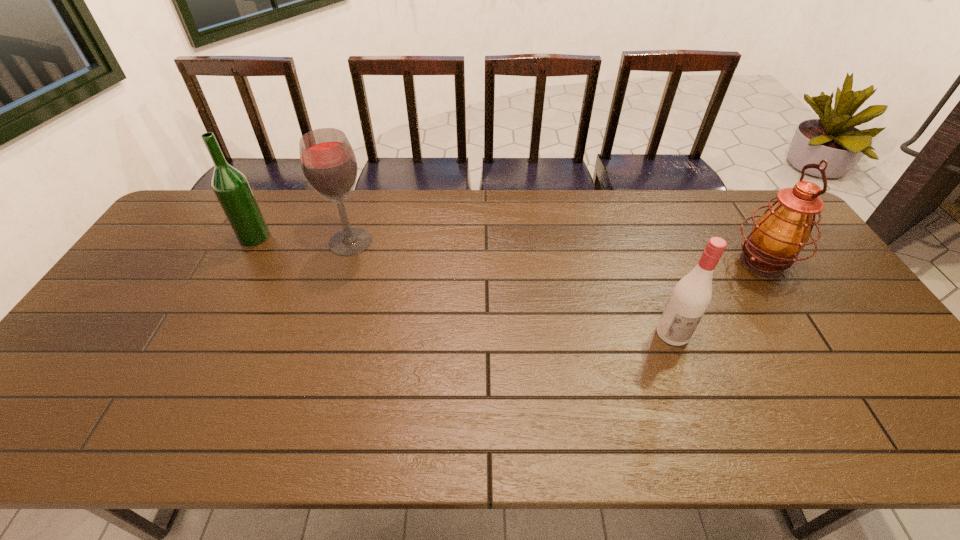
You are a GUI agent. You are given a task and a screenshot of the screen. Output one action in this format:
    pyautogui.click(x=<x>, y=<y>)
    Task: Click on the free space between the rightmost alcohol and the leftmost alcohol
    
    Given the screenshot: What is the action you would take?
    pyautogui.click(x=464, y=285)

Locate an element on the screen. The height and width of the screenshot is (540, 960). free area in between the oil lamp and the leftmost alcohol is located at coordinates (508, 250).

Locate an element on the screen. vacant space that is in between the second alcohol from right to left and the rightmost alcohol is located at coordinates (512, 287).

Locate an element on the screen. This screenshot has width=960, height=540. vacant space that is in between the oil lamp and the third object from right to left is located at coordinates (556, 252).

Image resolution: width=960 pixels, height=540 pixels. What are the coordinates of `free space between the leftmost object and the oil lamp` in the screenshot? It's located at (508, 250).

Identify the location of free spot between the rightmost object and the second alcohol from right to left. This screenshot has width=960, height=540. pos(556,252).

The image size is (960, 540). I want to click on the third closest object to the leftmost object, so click(783, 230).

Select which object is the third closest to the third object from right to left. Please provide its 2D coordinates. Your answer should be formatted as a tuple, i.e. [(x, y)], where the tuple contains the x and y coordinates of a point satisfying the conditions above.

[(783, 230)]

Locate an element on the screen. alcohol that is the nearest to the leftmost alcohol is located at coordinates coord(328,162).

Image resolution: width=960 pixels, height=540 pixels. I want to click on alcohol that is the nearest to the third object from left to right, so click(328, 162).